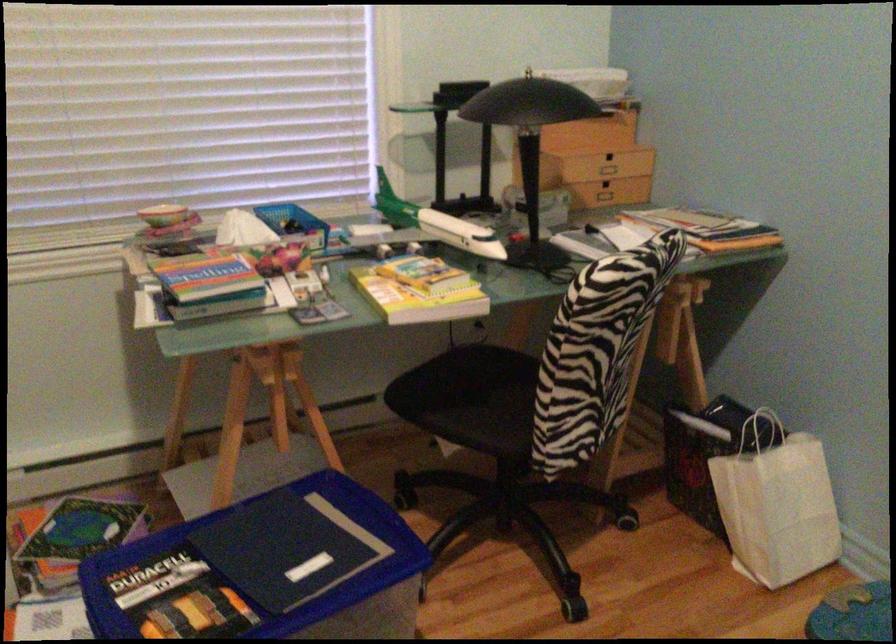
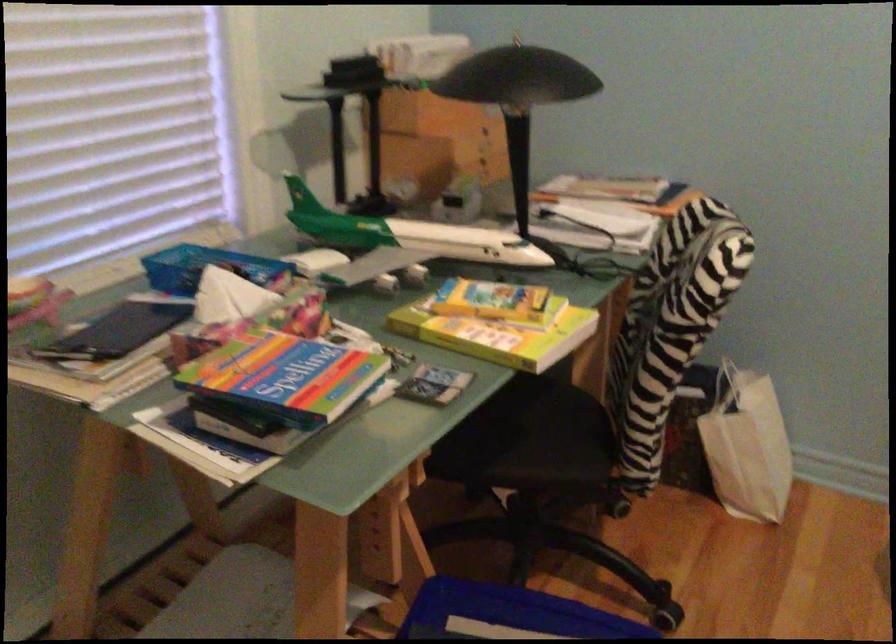
Locate, in the second image, the point that corresponds to (x=528, y=172) in the first image.

(519, 158)